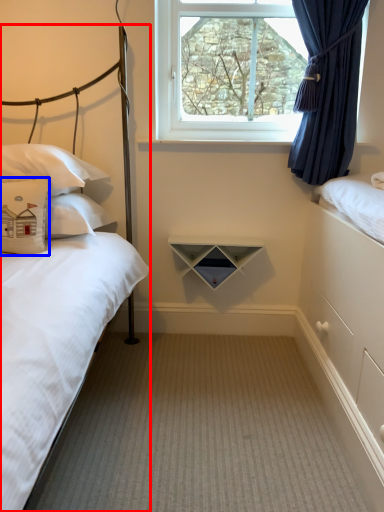
Question: Which object appears closest to the camera in this image, bed (highlighted by a red box) or pillow (highlighted by a blue box)?

Choices:
 (A) bed
 (B) pillow

Answer: (A)